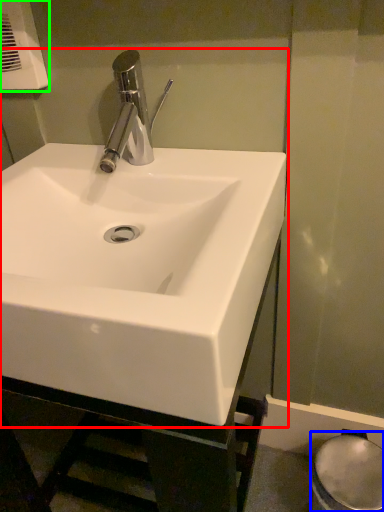
Question: Which object is the closest to the sink (highlighted by a red box)? Choose among these: bidet (highlighted by a blue box) or hand dryer (highlighted by a green box).

Choices:
 (A) bidet
 (B) hand dryer

Answer: (B)